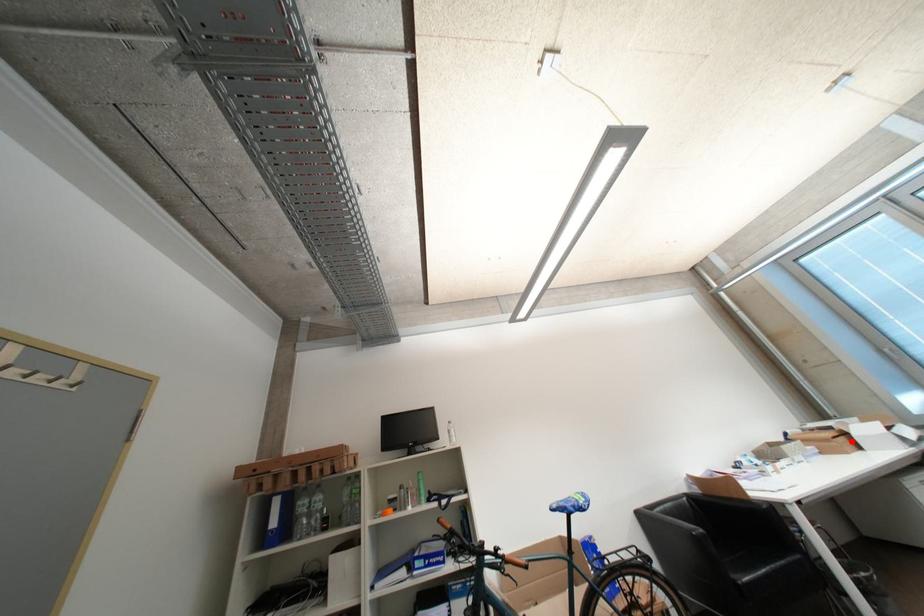
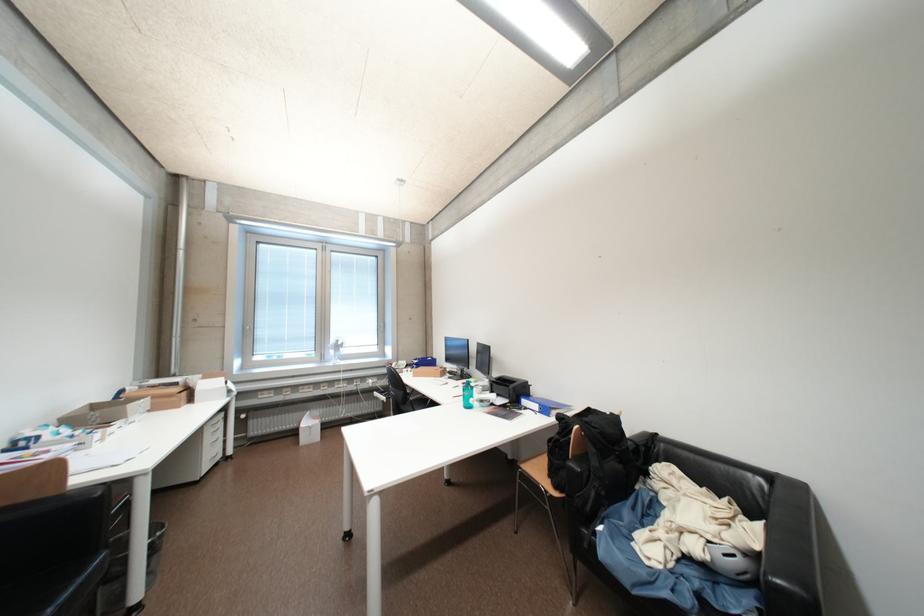
Question: I am providing you with two images of the same scene from different viewpoints. A red point is shown in image1. For the corresponding object point in image2, is it positioned nearer or farther from the camera?

Choices:
 (A) Nearer
 (B) Farther

Answer: (B)